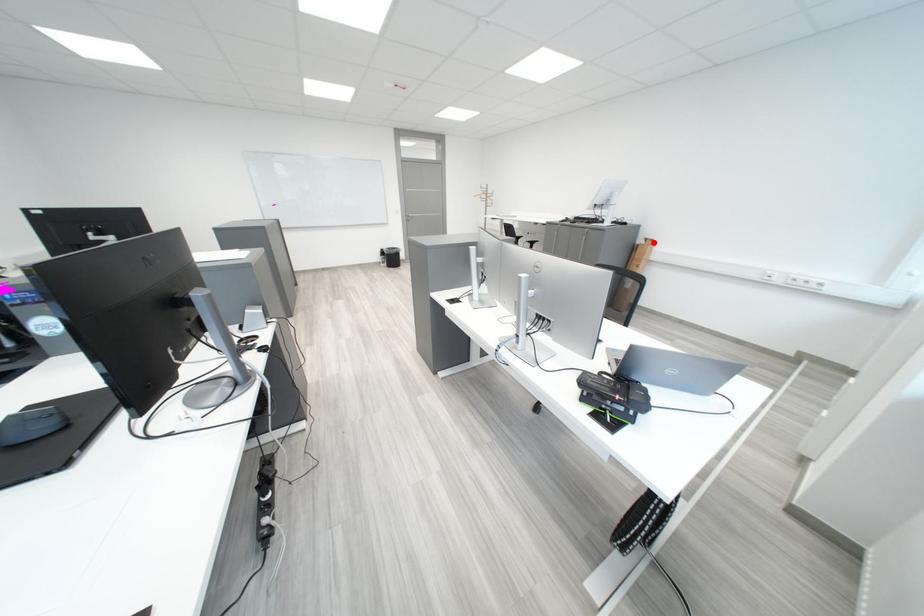
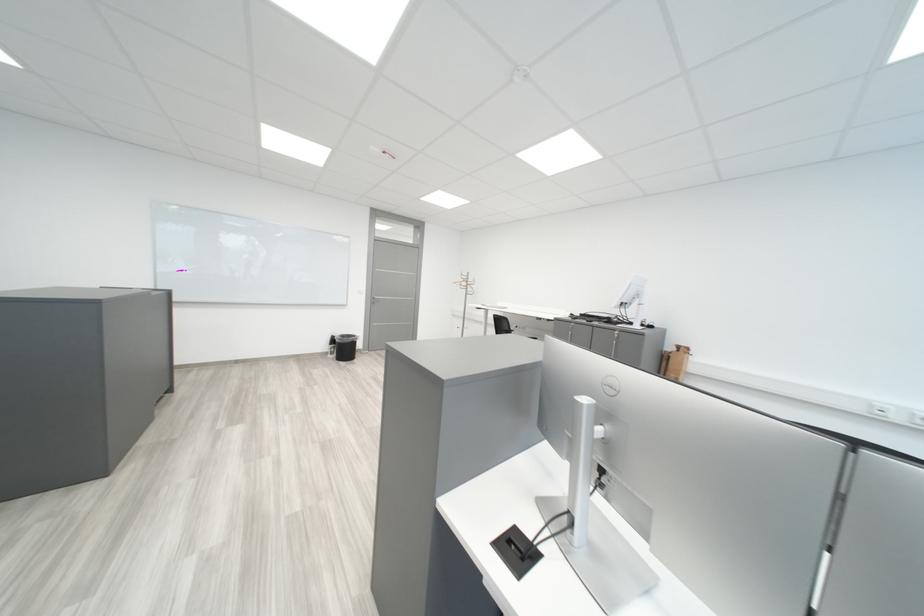
Question: I am providing you with two images of the same scene from different viewpoints. A red point is shown in image1. For the corresponding object point in image2, is it positioned nearer or farther from the camera?

Choices:
 (A) Nearer
 (B) Farther

Answer: (B)